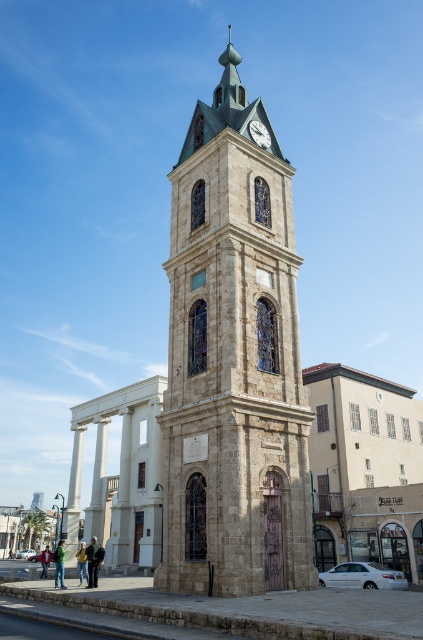
Is point (71, 499) behind point (101, 472)?

Yes, it is.

Does white marble pillar at lower left come behind white stone pillar at lower left?

No, it is in front of white stone pillar at lower left.

Is point (76, 524) farther from viewer compared to point (98, 515)?

Yes, point (76, 524) is farther from viewer.

Identify the location of white marble pillar at lower left. The image size is (423, 640). (74, 493).

Is white stone pillar at lower left in front of dark gray stone clock at upper center?

No.

Which is more to the right, white stone pillar at lower left or dark gray stone clock at upper center?

dark gray stone clock at upper center is more to the right.

Which is in front, point (87, 520) or point (260, 124)?

Point (260, 124)

Find the location of a particular element. This screenshot has height=640, width=423. white stone pillar at lower left is located at coordinates (96, 481).

Measure the distance from white marble pillar at lower left to dark gray stone clock at upper center.

39.28 meters

Does white marble pillar at lower left have a lesser height compared to dark gray stone clock at upper center?

In fact, white marble pillar at lower left may be taller than dark gray stone clock at upper center.

Locate an element on the screen. This screenshot has width=423, height=640. white marble pillar at lower left is located at coordinates (74, 493).

Where is `white marble pillar at lower left`? Image resolution: width=423 pixels, height=640 pixels. white marble pillar at lower left is located at coordinates (74, 493).